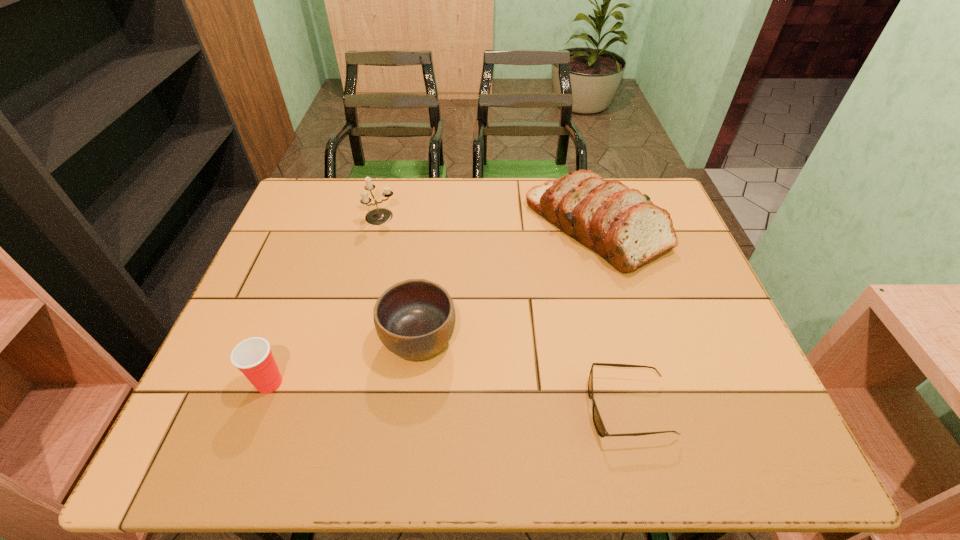
At what (x,y) coordinates should I click in order to perform the action: click on free spot located 0.130m on the lenses of the shortest object. Please return your answer as a coordinate pair (x, y). Looking at the image, I should click on (525, 408).

Identify the location of free space located on the lenses of the shortest object. This screenshot has width=960, height=540. (445, 408).

Identify the location of bread present at the far edge. (622, 225).

The width and height of the screenshot is (960, 540). What are the coordinates of `candle holder at the far edge` in the screenshot? It's located at point(379,216).

The width and height of the screenshot is (960, 540). In order to click on object that is at the near edge in this screenshot , I will do `click(597, 420)`.

This screenshot has height=540, width=960. Find the location of `object present at the left edge`. object present at the left edge is located at coordinates pyautogui.click(x=253, y=357).

Locate an element on the screen. object that is positioned at the right edge is located at coordinates tap(622, 225).

Identify the location of object located in the far right corner section of the desktop. The image size is (960, 540). (622, 225).

Image resolution: width=960 pixels, height=540 pixels. I want to click on vacant region at the far edge of the desktop, so click(518, 207).

In the image, there is a desktop. Find the location of `vacant area at the near edge`. vacant area at the near edge is located at coordinates (439, 441).